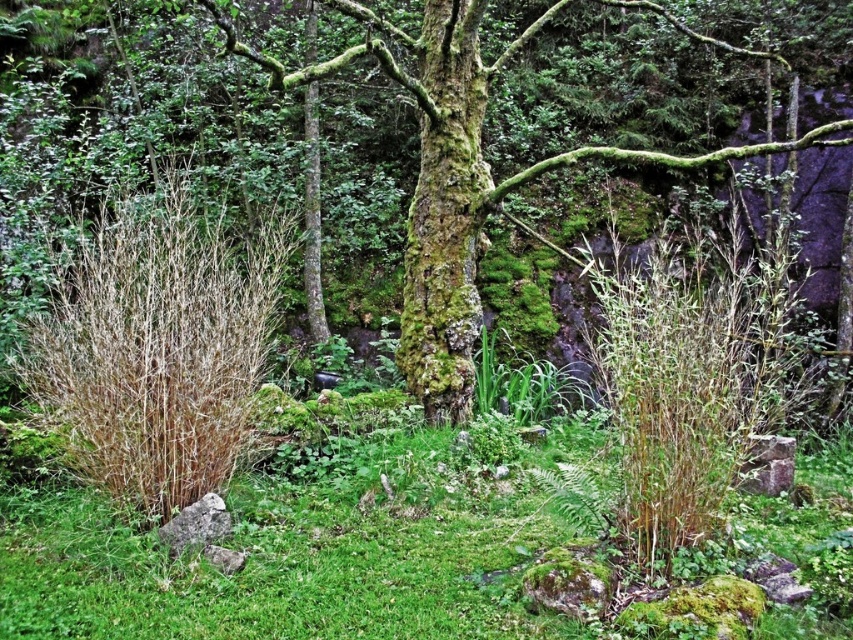
Question: Which object appears closest to the camera in this image?

Choices:
 (A) green mossy grass at center
 (B) green mossy tree at center

Answer: (A)

Question: Which of the following is the farthest from the observer?

Choices:
 (A) (556, 429)
 (B) (469, 221)

Answer: (A)

Question: Does green mossy grass at center appear on the left side of green mossy tree at center?

Choices:
 (A) no
 (B) yes

Answer: (B)

Question: Does green mossy grass at center come behind green mossy tree at center?

Choices:
 (A) yes
 (B) no

Answer: (B)

Question: Can you confirm if green mossy grass at center is thinner than green mossy tree at center?

Choices:
 (A) no
 (B) yes

Answer: (B)